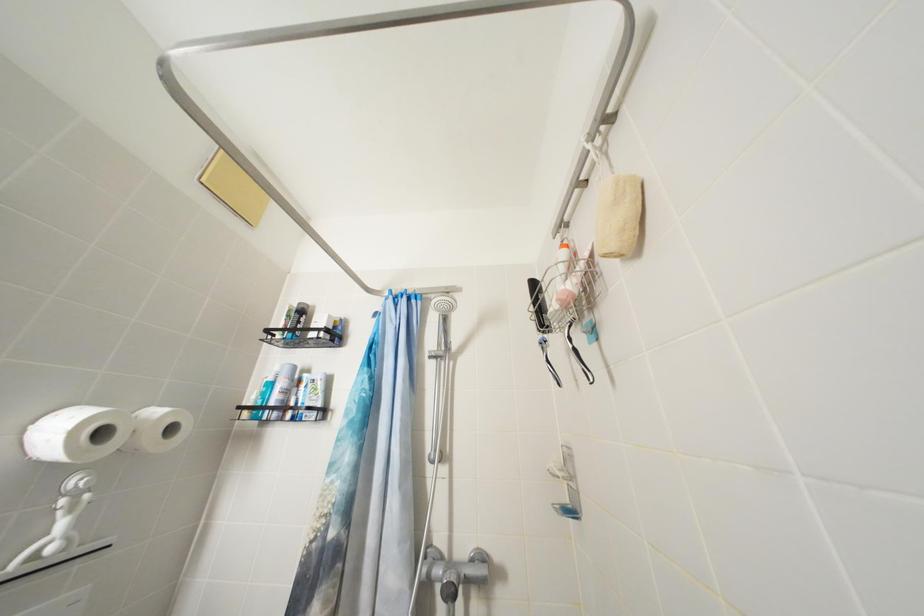
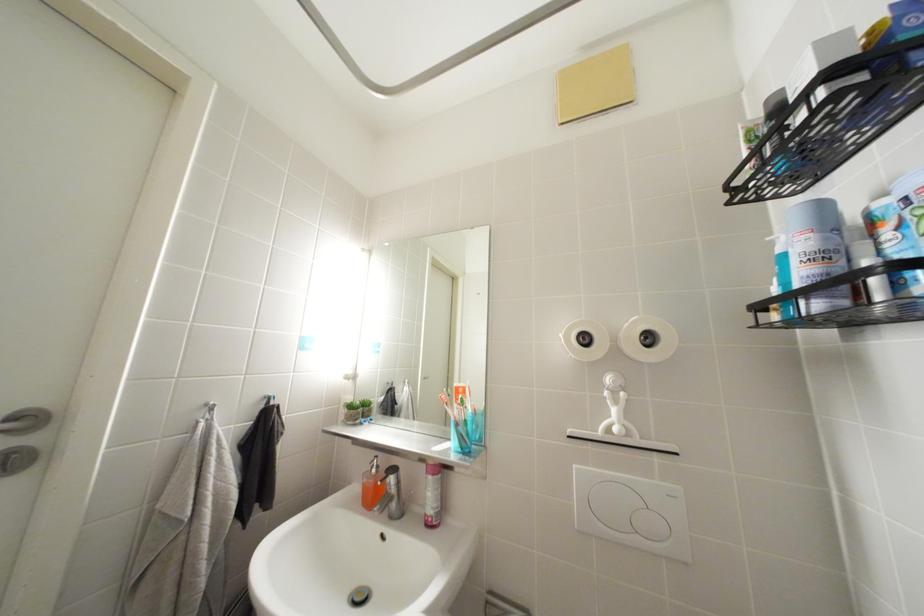
The images are taken continuously from a first-person perspective. In which direction is your viewpoint rotating?

The camera's rotation is toward left-up.